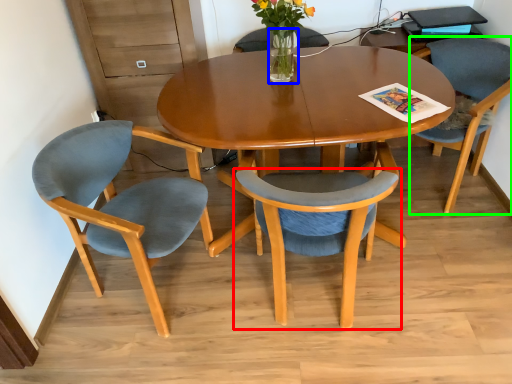
Question: Which is nearer to the chair (highlighted by a red box)? vase (highlighted by a blue box) or chair (highlighted by a green box).

Choices:
 (A) vase
 (B) chair

Answer: (A)